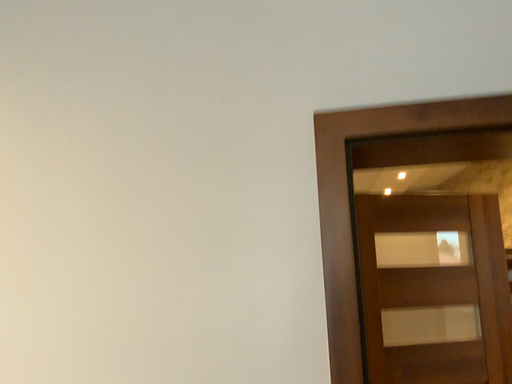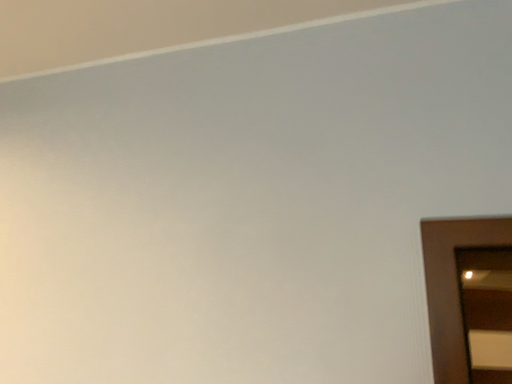
Question: Which way did the camera rotate in the video?

Choices:
 (A) rotated downward
 (B) rotated upward

Answer: (B)